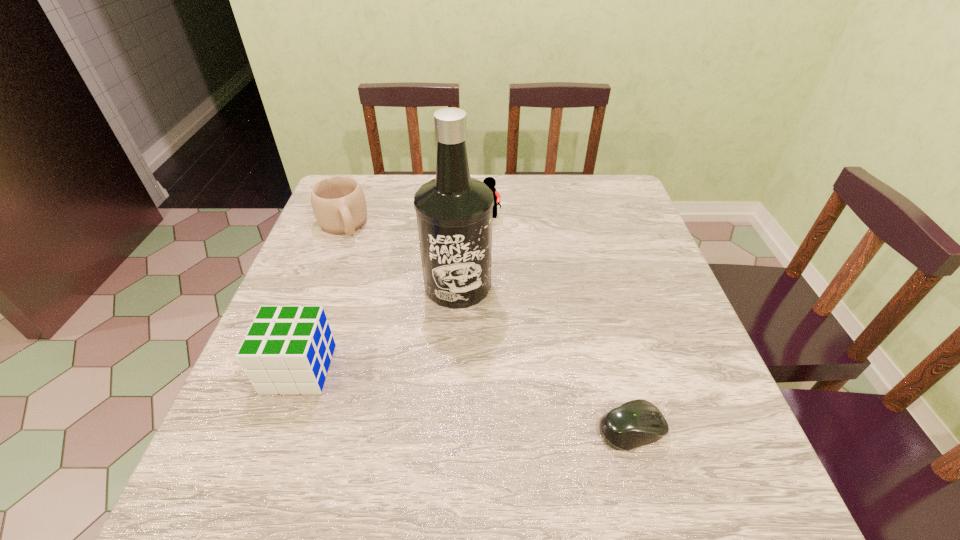
At what (x,y) coordinates should I click in order to perform the action: click on cube. Please return your answer as a coordinate pair (x, y). Looking at the image, I should click on (287, 350).

Where is `the shortest object`? the shortest object is located at coordinates (635, 423).

Locate an element on the screen. The height and width of the screenshot is (540, 960). the nearest object is located at coordinates (635, 423).

This screenshot has width=960, height=540. Identify the location of mug. (338, 202).

Locate an element on the screen. The height and width of the screenshot is (540, 960). Lego is located at coordinates (489, 181).

Where is `the third nearest object`? The height and width of the screenshot is (540, 960). the third nearest object is located at coordinates [x=454, y=212].

This screenshot has height=540, width=960. I want to click on the tallest object, so click(454, 212).

The image size is (960, 540). I want to click on vacant space located 0.400m on the left of the shortest object, so click(371, 429).

In order to click on vacant area located on the side of the mug with the handle in this screenshot , I will do `click(388, 329)`.

The image size is (960, 540). In order to click on free region located on the side of the mug with the handle in this screenshot , I will do `click(352, 252)`.